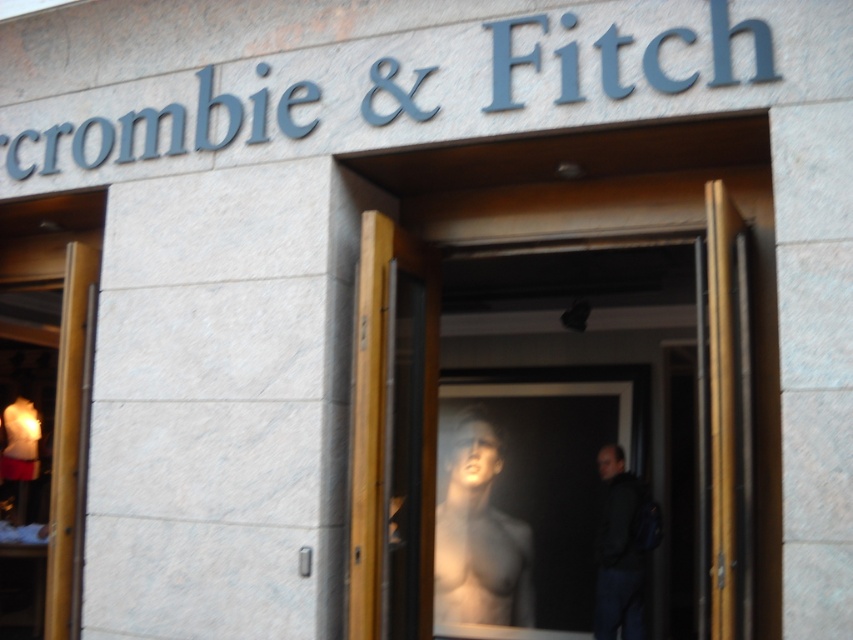
Question: Considering the real-world distances, which object is farthest from the transparent glass mannequin torso at center?

Choices:
 (A) smooth skin torso at center
 (B) dark blue jacket at center
 (C) wooden at center

Answer: (C)

Question: Is smooth skin torso at center smaller than dark blue jacket at center?

Choices:
 (A) no
 (B) yes

Answer: (A)

Question: Based on their relative distances, which object is nearer to the smooth skin torso at center?

Choices:
 (A) dark blue jacket at center
 (B) transparent glass mannequin torso at center

Answer: (B)

Question: Is wooden at center positioned behind dark blue jacket at center?

Choices:
 (A) yes
 (B) no

Answer: (B)

Question: Which object is positioned farthest from the transparent glass mannequin torso at center?

Choices:
 (A) dark blue jacket at center
 (B) wooden at center
 (C) smooth skin torso at center

Answer: (B)

Question: Is transparent glass mannequin torso at center smaller than smooth skin torso at center?

Choices:
 (A) yes
 (B) no

Answer: (B)